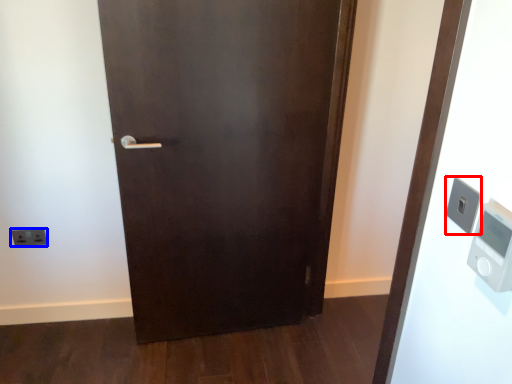
Question: Among these objects, which one is farthest to the camera, light switch (highlighted by a red box) or light switch (highlighted by a blue box)?

Choices:
 (A) light switch
 (B) light switch

Answer: (B)